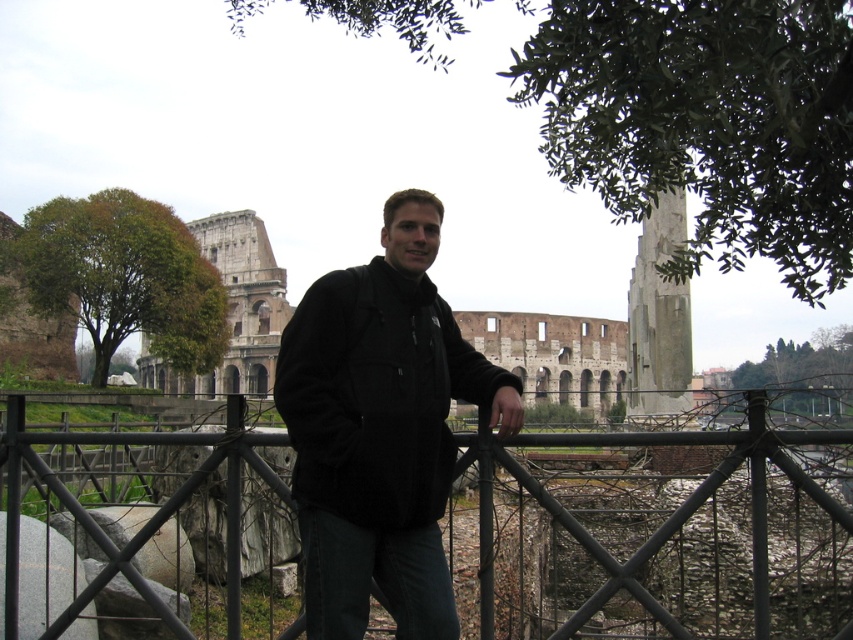
Which is above, black matte jacket at center or black metal fence at center?

Positioned higher is black matte jacket at center.

In the scene shown: Measure the distance between black matte jacket at center and camera.

65.77 meters

Between point (306, 298) and point (236, 497), which one is positioned behind?

Positioned behind is point (306, 298).

Where is `black matte jacket at center`? The image size is (853, 640). black matte jacket at center is located at coordinates (380, 429).